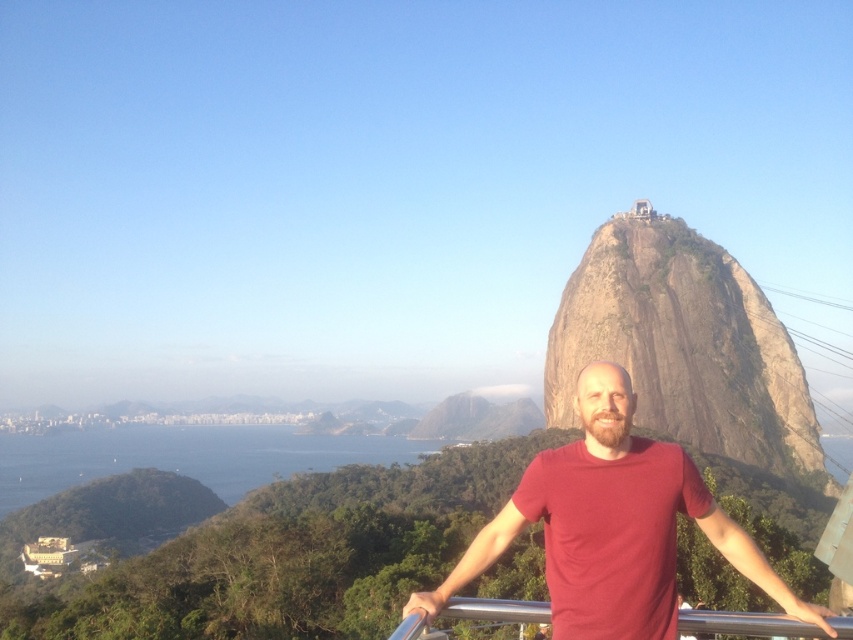
Question: Among these objects, which one is nearest to the camera?

Choices:
 (A) rocky brown at center
 (B) silver metallic rail at center
 (C) red matte t-shirt at center

Answer: (B)

Question: Which object appears closest to the camera in this image?

Choices:
 (A) silver metallic rail at center
 (B) red matte t-shirt at center

Answer: (A)

Question: Is rocky brown at center in front of red matte t-shirt at center?

Choices:
 (A) yes
 (B) no

Answer: (B)

Question: Estimate the real-world distances between objects in this image. Which object is farther from the rocky brown at center?

Choices:
 (A) red matte t-shirt at center
 (B) silver metallic rail at center

Answer: (B)

Question: Can you confirm if rocky brown at center is positioned to the right of red matte t-shirt at center?

Choices:
 (A) no
 (B) yes

Answer: (B)

Question: Is red matte t-shirt at center wider than silver metallic rail at center?

Choices:
 (A) yes
 (B) no

Answer: (B)